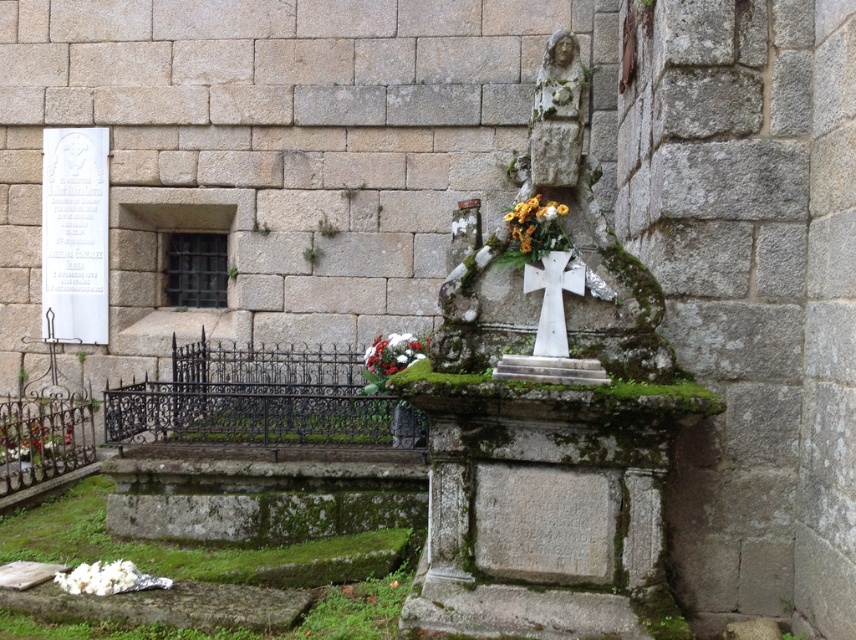
You are standing in front of the monument and want to place a new bouquet of flowers. The current flowers are yellow matte flowers at center. Where should you place the new bouquet so it is visible in front of the white stone cross at center?

The yellow matte flowers at center are behind the white stone cross at center. To make the new bouquet visible in front, place it in front of the white stone cross at center, ensuring it is not obscured by the existing flowers.

You are standing in front of the weathered stone monument in the cemetery. You notice two flower arrangements at the center of the monument. Which of the two flowers, the yellow matte flowers at center or the white matte flowers at center, is shorter?

The yellow matte flowers at center is shorter compared to the white matte flowers at center.